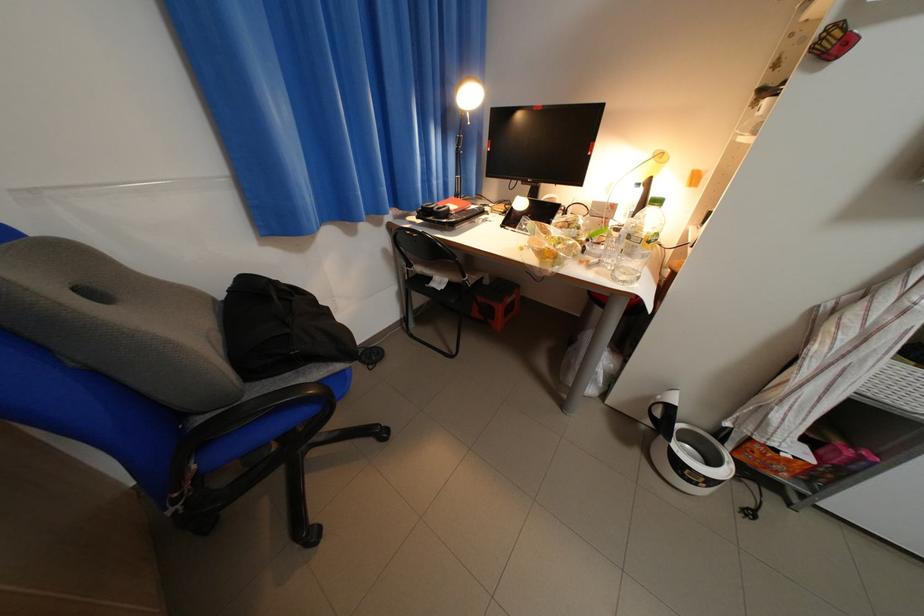
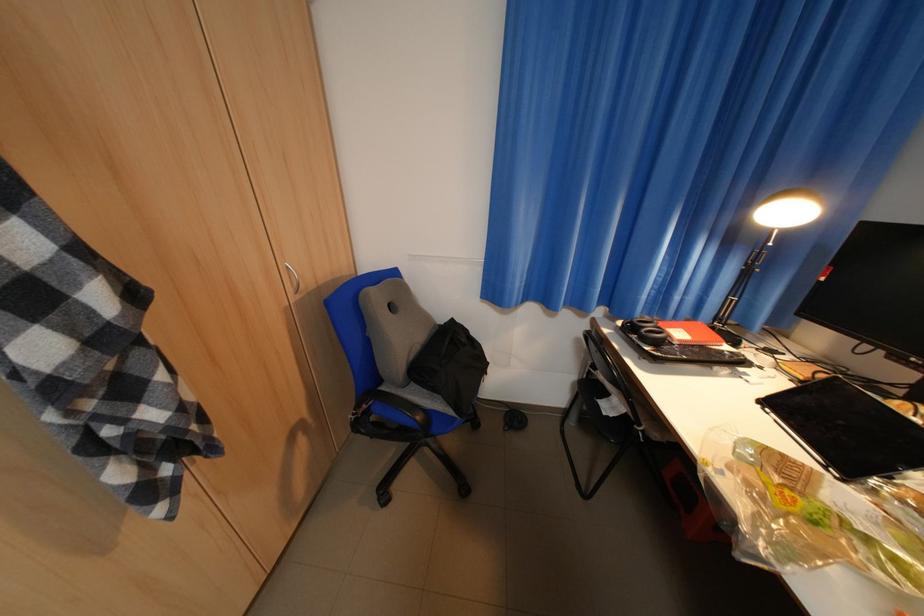
Question: The camera is either moving clockwise (left) or counter-clockwise (right) around the object. The first image is from the beginning of the video and the second image is from the end. Is the camera moving left or right when shooting the video?

Choices:
 (A) Left
 (B) Right

Answer: (B)